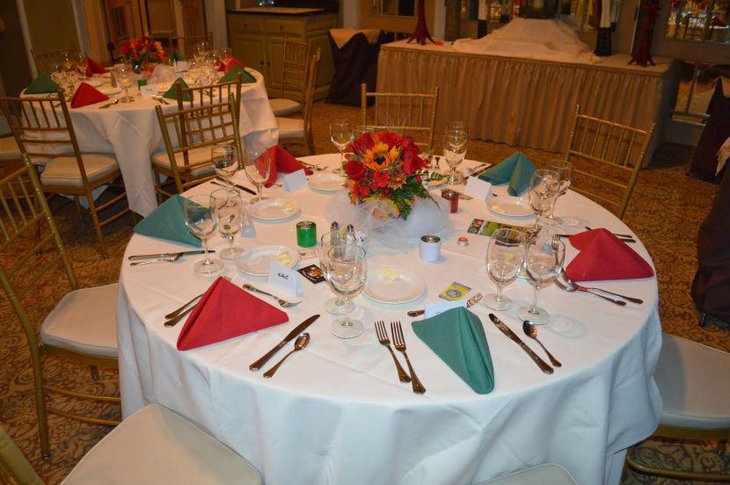
In order to click on fork in this screenshot , I will do `click(395, 341)`.